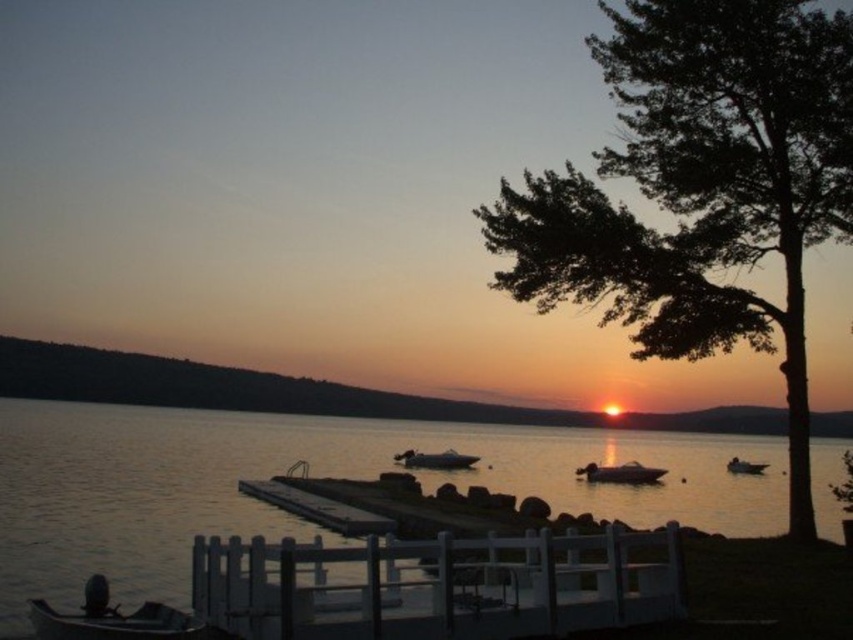
Question: Observing the image, what is the correct spatial positioning of metallic gray boat at lower left in reference to glossy black boat at lower right?

Choices:
 (A) above
 (B) below

Answer: (A)

Question: Which point is closer to the camera taking this photo?

Choices:
 (A) (61, 625)
 (B) (430, 461)
 (C) (730, 467)

Answer: (A)

Question: Which point is closer to the camera?

Choices:
 (A) (756, 465)
 (B) (439, 465)
 (C) (233, 557)
 (D) (111, 637)

Answer: (C)

Question: Which point appears closest to the camera in this image?

Choices:
 (A) (607, 467)
 (B) (225, 627)
 (C) (463, 460)
 (D) (543, 202)

Answer: (B)

Question: Can you confirm if glossy black boat at lower right is bigger than glossy white boat at center?

Choices:
 (A) yes
 (B) no

Answer: (A)

Question: Does metallic gray boat at lower left appear on the right side of metallic silver boat at lower right?

Choices:
 (A) yes
 (B) no

Answer: (B)